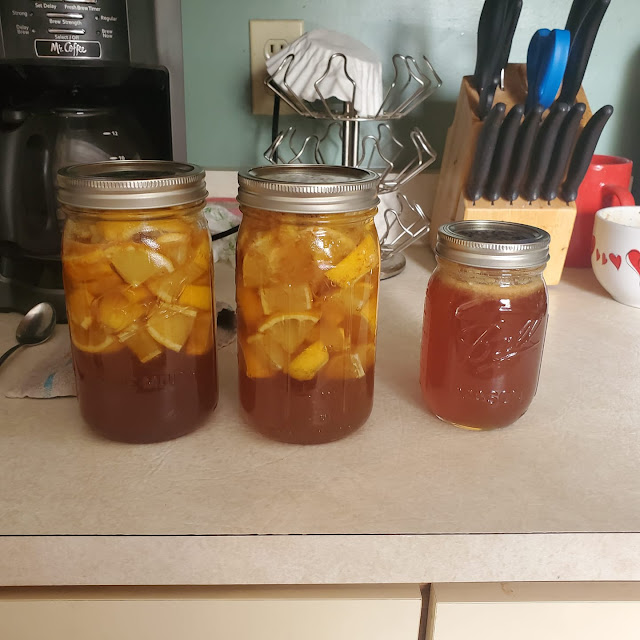
The width and height of the screenshot is (640, 640). In order to click on coffe pitcher in this screenshot , I will do `click(58, 156)`.